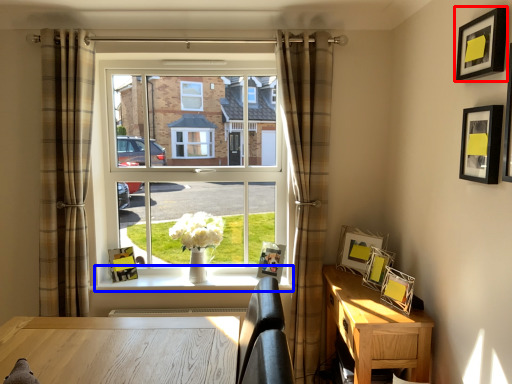
Question: Which point is closer to the camera, picture frame (highlighted by a red box) or window sill (highlighted by a blue box)?

Choices:
 (A) picture frame
 (B) window sill

Answer: (A)